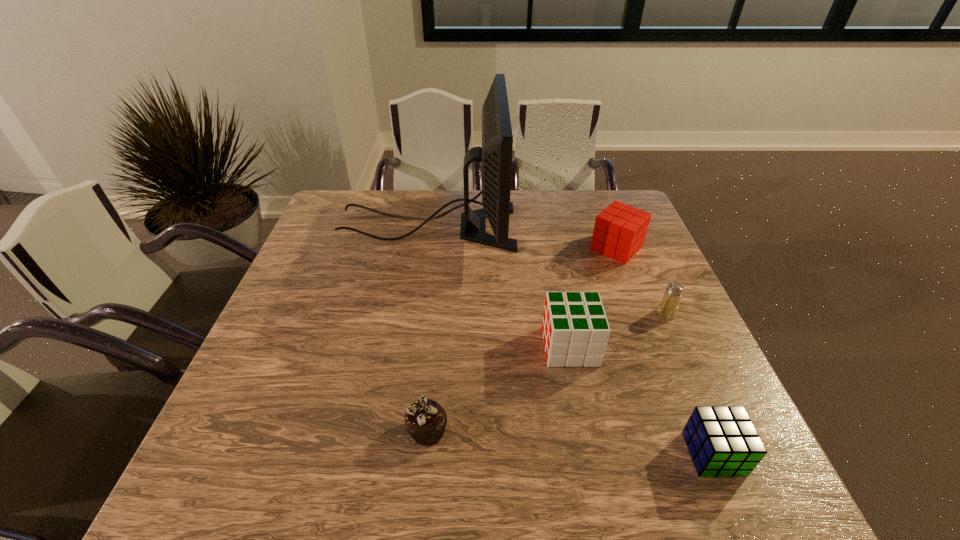
At what (x,y) coordinates should I click in order to perform the action: click on object at the near right corner. Please return your answer as a coordinate pair (x, y). Image resolution: width=960 pixels, height=540 pixels. Looking at the image, I should click on (722, 441).

You are a GUI agent. You are given a task and a screenshot of the screen. Output one action in this format:
    pyautogui.click(x=<x>, y=<y>)
    Task: Click on the free location at the far edge of the desktop
    
    Given the screenshot: What is the action you would take?
    pyautogui.click(x=566, y=200)

The image size is (960, 540). I want to click on vacant space at the near edge, so click(x=299, y=492).

You are a GUI agent. You are given a task and a screenshot of the screen. Output one action in this format:
    pyautogui.click(x=<x>, y=<y>)
    Task: Click on the vacant area at the left edge of the desktop
    This screenshot has height=540, width=960.
    Given the screenshot: What is the action you would take?
    pyautogui.click(x=276, y=450)

You are a GUI agent. You are given a task and a screenshot of the screen. Output one action in this format:
    pyautogui.click(x=<x>, y=<y>)
    Task: Click on the vacant area at the right edge of the desktop
    Image resolution: width=960 pixels, height=540 pixels.
    Given the screenshot: What is the action you would take?
    pyautogui.click(x=701, y=382)

You are a GUI agent. You are given a task and a screenshot of the screen. Output one action in this format:
    pyautogui.click(x=<x>, y=<y>)
    Task: Click on the vacant space at the far left corner
    
    Given the screenshot: What is the action you would take?
    click(x=368, y=201)

Image resolution: width=960 pixels, height=540 pixels. In the image, there is a desktop. In order to click on vacant space at the far right corner in this screenshot , I will do `click(589, 197)`.

You are a GUI agent. You are given a task and a screenshot of the screen. Output one action in this format:
    pyautogui.click(x=<x>, y=<y>)
    Task: Click on the free space that is in between the farthest cube and the tallest object
    The height and width of the screenshot is (540, 960).
    Given the screenshot: What is the action you would take?
    pyautogui.click(x=522, y=238)

I want to click on free space that is in between the cupcake and the shortest cube, so click(x=570, y=442).

You are a GUI agent. You are given a task and a screenshot of the screen. Output one action in this format:
    pyautogui.click(x=<x>, y=<y>)
    Task: Click on the empty space between the cupcake and the fourth farthest object
    This screenshot has width=960, height=540.
    Given the screenshot: What is the action you would take?
    pyautogui.click(x=499, y=388)